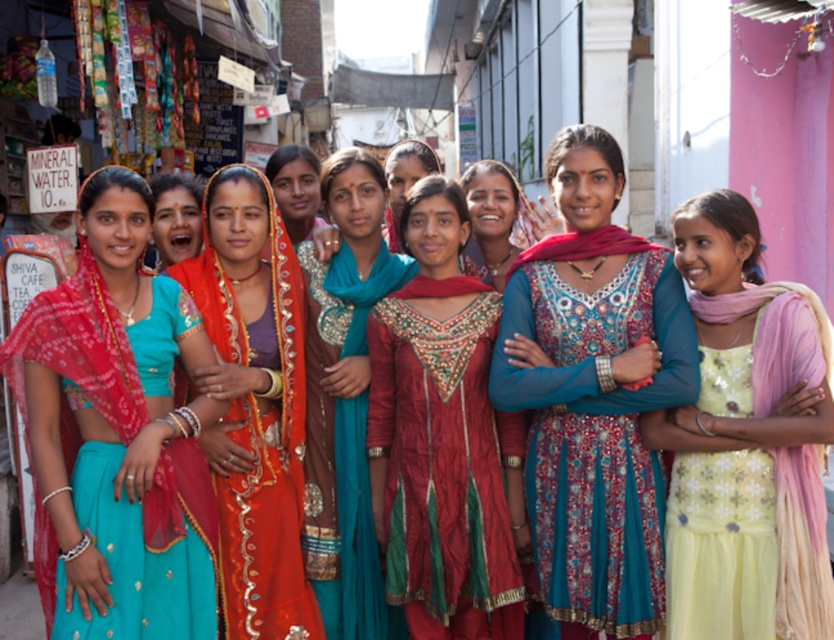
Question: Does teal silk scarf at center have a greater width compared to yellow sequined dress at right?

Choices:
 (A) no
 (B) yes

Answer: (B)

Question: Is shiny orange saree at center positioned before teal silk scarf at center?

Choices:
 (A) no
 (B) yes

Answer: (B)

Question: Which point appears farthest from the camera in this image?

Choices:
 (A) (284, 326)
 (B) (423, 333)

Answer: (A)

Question: Which object appears closest to the camera in this image?

Choices:
 (A) shiny red dress at center
 (B) matte teal dress at center
 (C) blue embroidered dress at center

Answer: (C)

Question: Is matte teal saree at left positioned in front of light yellow sequined dress at center?

Choices:
 (A) no
 (B) yes

Answer: (B)

Question: Which point is closer to the camera?

Choices:
 (A) light yellow sequined dress at center
 (B) matte red scarf at center

Answer: (A)